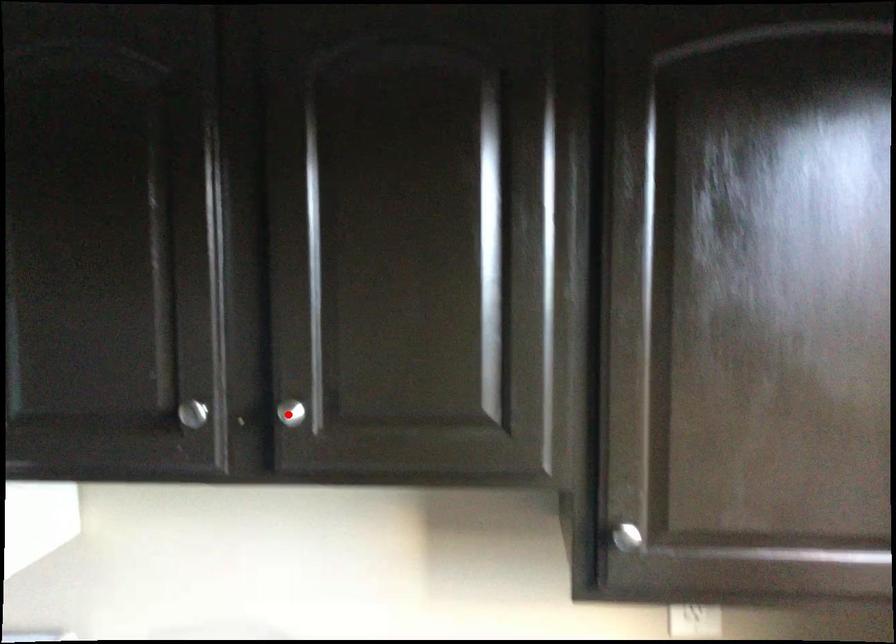
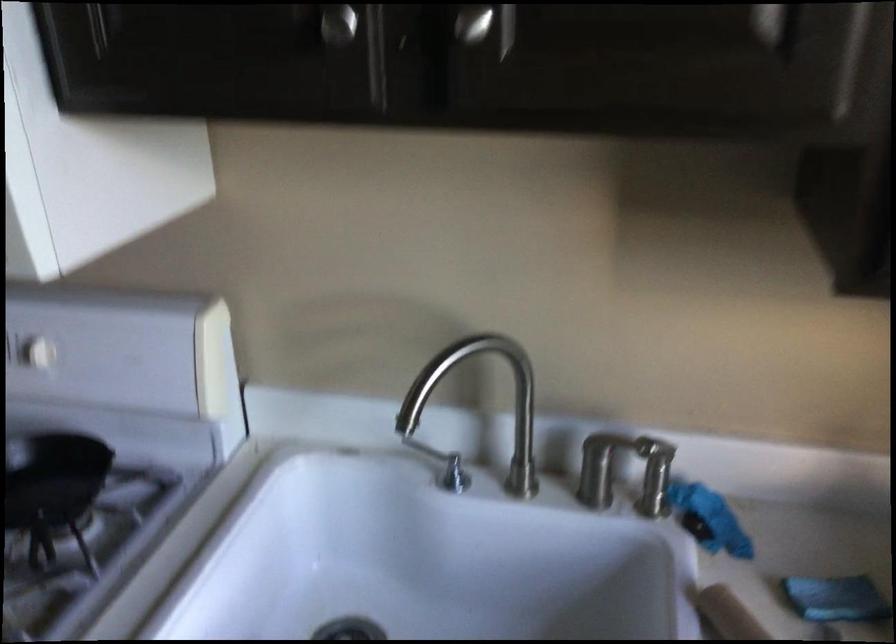
In the second image, find the point that corresponds to the highlighted location in the first image.

(472, 23)